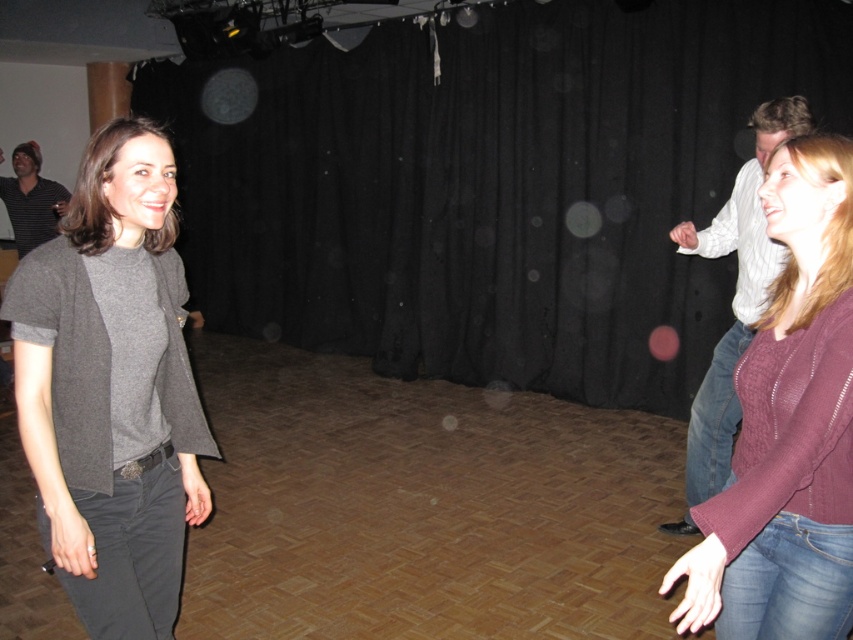
Can you confirm if black matte curtain at center is smaller than striped cotton shirt at left?

No, black matte curtain at center is not smaller than striped cotton shirt at left.

Who is lower down, black matte curtain at center or striped cotton shirt at left?

striped cotton shirt at left is lower down.

Is point (576, 26) farther from camera compared to point (16, 230)?

No, it is in front of (16, 230).

In order to click on black matte curtain at center in this screenshot , I will do `click(492, 186)`.

Does black matte curtain at center have a larger size compared to jeans at right?

Yes, black matte curtain at center is bigger than jeans at right.

Which is above, black matte curtain at center or jeans at right?

Positioned higher is black matte curtain at center.

Describe the element at coordinates (492, 186) in the screenshot. The width and height of the screenshot is (853, 640). I see `black matte curtain at center` at that location.

What are the coordinates of `black matte curtain at center` in the screenshot? It's located at (492, 186).

How distant is gray wool sweater at left from jeans at lower right?

gray wool sweater at left is 1.31 meters from jeans at lower right.

Between point (74, 593) and point (796, 600), which one is positioned behind?

The point (74, 593) is more distant.

Where is `gray wool sweater at left`? gray wool sweater at left is located at coordinates (112, 387).